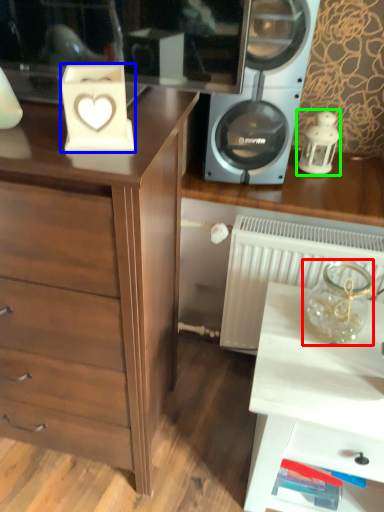
Question: Based on their relative distances, which object is nearer to glass vase (highlighted by a red box)? Choose from appliance (highlighted by a blue box) and candle holder (highlighted by a green box).

Choices:
 (A) appliance
 (B) candle holder

Answer: (B)